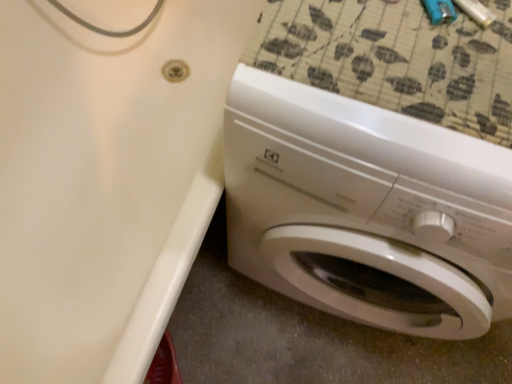
Question: Does white glossy washing machine at lower right have a lesser height compared to white glossy bathtub at lower right?

Choices:
 (A) no
 (B) yes

Answer: (A)

Question: Is white glossy washing machine at lower right smaller than white glossy bathtub at lower right?

Choices:
 (A) yes
 (B) no

Answer: (A)

Question: Can you confirm if white glossy washing machine at lower right is wider than white glossy bathtub at lower right?

Choices:
 (A) no
 (B) yes

Answer: (A)

Question: Is white glossy washing machine at lower right not within white glossy bathtub at lower right?

Choices:
 (A) no
 (B) yes

Answer: (B)

Question: Can you confirm if white glossy washing machine at lower right is taller than white glossy bathtub at lower right?

Choices:
 (A) no
 (B) yes

Answer: (B)

Question: From a real-world perspective, does white glossy washing machine at lower right sit lower than white glossy bathtub at lower right?

Choices:
 (A) no
 (B) yes

Answer: (A)

Question: Considering the relative sizes of white glossy bathtub at lower right and white glossy washing machine at lower right in the image provided, is white glossy bathtub at lower right shorter than white glossy washing machine at lower right?

Choices:
 (A) yes
 (B) no

Answer: (A)

Question: From the image's perspective, is white glossy bathtub at lower right under white glossy washing machine at lower right?

Choices:
 (A) no
 (B) yes

Answer: (A)

Question: Is white glossy bathtub at lower right placed right next to white glossy washing machine at lower right?

Choices:
 (A) no
 (B) yes

Answer: (A)

Question: Is white glossy bathtub at lower right facing away from white glossy washing machine at lower right?

Choices:
 (A) yes
 (B) no

Answer: (B)

Question: Is white glossy bathtub at lower right to the left of white glossy washing machine at lower right from the viewer's perspective?

Choices:
 (A) no
 (B) yes

Answer: (B)

Question: From a real-world perspective, is white glossy bathtub at lower right over white glossy washing machine at lower right?

Choices:
 (A) no
 (B) yes

Answer: (A)

Question: From a real-world perspective, is white glossy bathtub at lower right above or below white glossy washing machine at lower right?

Choices:
 (A) below
 (B) above

Answer: (A)